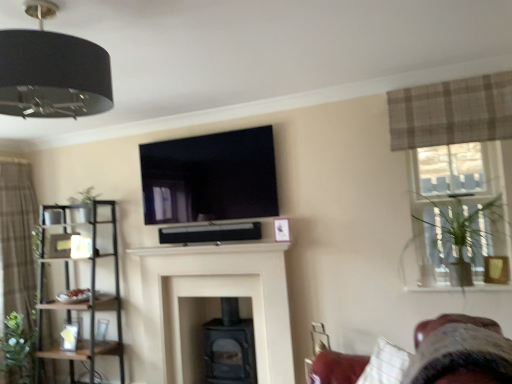
Question: Is brown textured curtain at left, the second curtain positioned from the right, taller or shorter than clear glass window at upper right?

Choices:
 (A) short
 (B) tall

Answer: (B)

Question: From the image's perspective, is brown textured curtain at left, the first curtain in the back-to-front sequence, positioned above or below clear glass window at upper right?

Choices:
 (A) above
 (B) below

Answer: (B)

Question: Estimate the real-world distances between objects in this image. Which object is closer to the brown textured curtain at left, the first curtain ordered from the bottom?

Choices:
 (A) black glossy tv at upper center
 (B) matte black fireplace at center, which ranks as the 2th fireplace in back-to-front order
 (C) clear glass window at upper right
 (D) black matte fireplace at center, which is the first fireplace from back to front
 (E) plaid fabric curtain at upper right, acting as the 2th curtain starting from the bottom

Answer: (B)

Question: Which of these objects is positioned farthest from the black matte fireplace at center, arranged as the 2th fireplace when viewed from the front?

Choices:
 (A) matte black fireplace at center, which ranks as the 2th fireplace in back-to-front order
 (B) green matte plant at upper left, arranged as the first plant when viewed from the right
 (C) green leafy plant at left, marked as the first plant in a bottom-to-top arrangement
 (D) clear glass window at upper right
 (E) black metal shelf at left

Answer: (D)